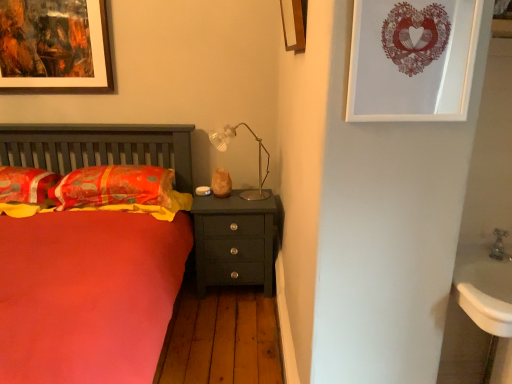
Question: Does matte orange pillow at left, which is the 2th pillow from right to left, have a lesser width compared to matte dark green nightstand at center?

Choices:
 (A) yes
 (B) no

Answer: (B)

Question: Is there a large distance between matte orange pillow at left, which is the 2th pillow from right to left, and matte dark green nightstand at center?

Choices:
 (A) no
 (B) yes

Answer: (B)

Question: Does matte orange pillow at left, which is the 2th pillow from right to left, have a smaller size compared to matte dark green nightstand at center?

Choices:
 (A) no
 (B) yes

Answer: (B)

Question: From the image's perspective, is matte orange pillow at left, marked as the 1th pillow in a left-to-right arrangement, located above matte dark green nightstand at center?

Choices:
 (A) no
 (B) yes

Answer: (B)

Question: From a real-world perspective, is matte orange pillow at left, marked as the 1th pillow in a left-to-right arrangement, located beneath matte dark green nightstand at center?

Choices:
 (A) no
 (B) yes

Answer: (A)

Question: Is wooden picture frame at upper center, which appears as the 2th picture frame when viewed from the front, in front of or behind gold metallic table lamp at center in the image?

Choices:
 (A) behind
 (B) front

Answer: (B)

Question: From the image's perspective, relative to gold metallic table lamp at center, is wooden picture frame at upper center, which appears as the 2th picture frame when viewed from the front, above or below?

Choices:
 (A) below
 (B) above

Answer: (B)

Question: From a real-world perspective, is wooden picture frame at upper center, which appears as the 2th picture frame when viewed from the back, physically located above or below gold metallic table lamp at center?

Choices:
 (A) above
 (B) below

Answer: (A)

Question: In terms of size, does wooden picture frame at upper center, which ranks as the second picture frame in right-to-left order, appear bigger or smaller than gold metallic table lamp at center?

Choices:
 (A) small
 (B) big

Answer: (A)

Question: In terms of width, does matte paper picture frame at upper right, which ranks as the 1th picture frame in right-to-left order, look wider or thinner when compared to wooden picture frame at upper center, which appears as the 2th picture frame when viewed from the front?

Choices:
 (A) thin
 (B) wide

Answer: (A)

Question: From the image's perspective, is matte paper picture frame at upper right, which appears as the 1th picture frame when viewed from the front, above or below wooden picture frame at upper center, which ranks as the second picture frame in right-to-left order?

Choices:
 (A) above
 (B) below

Answer: (B)

Question: Is matte paper picture frame at upper right, which is the third picture frame from back to front, spatially inside wooden picture frame at upper center, which appears as the 2th picture frame when viewed from the front, or outside of it?

Choices:
 (A) outside
 (B) inside

Answer: (A)

Question: Looking at the image, does matte paper picture frame at upper right, which ranks as the third picture frame in left-to-right order, seem bigger or smaller compared to wooden picture frame at upper center, the 2th picture frame in the left-to-right sequence?

Choices:
 (A) big
 (B) small

Answer: (B)

Question: Considering the positions of point click(500, 251) and point click(474, 26), is point click(500, 251) closer or farther from the camera than point click(474, 26)?

Choices:
 (A) farther
 (B) closer

Answer: (A)

Question: Would you say metallic silver faucet at lower right is inside or outside matte paper picture frame at upper right, which ranks as the 1th picture frame in right-to-left order?

Choices:
 (A) inside
 (B) outside

Answer: (B)